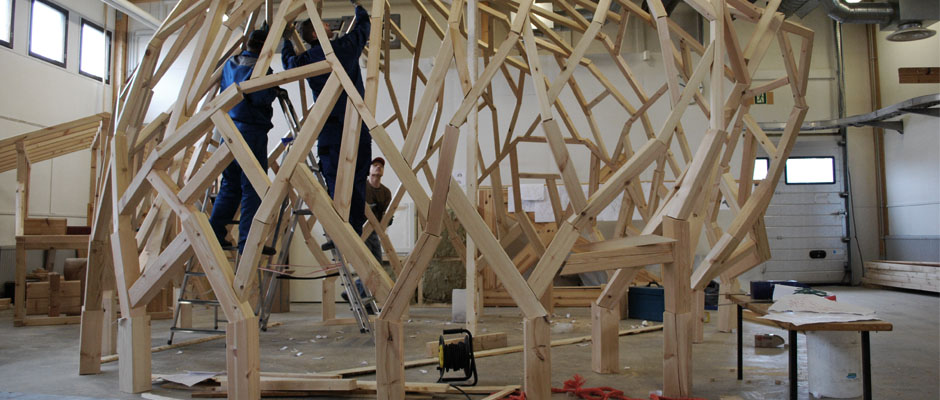
This screenshot has width=940, height=400. I want to click on garage windows, so click(819, 168), click(100, 63), click(57, 35), click(5, 23).